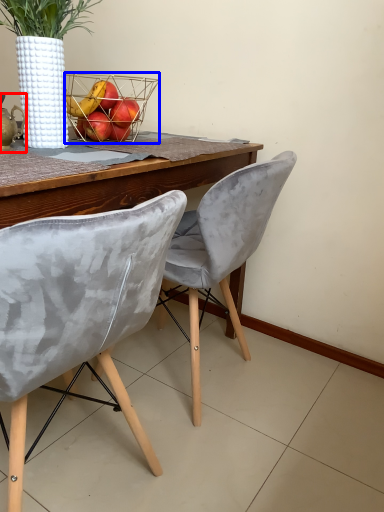
Question: Which object appears farthest to the camera in this image, tea pot (highlighted by a red box) or basket (highlighted by a blue box)?

Choices:
 (A) tea pot
 (B) basket

Answer: (B)